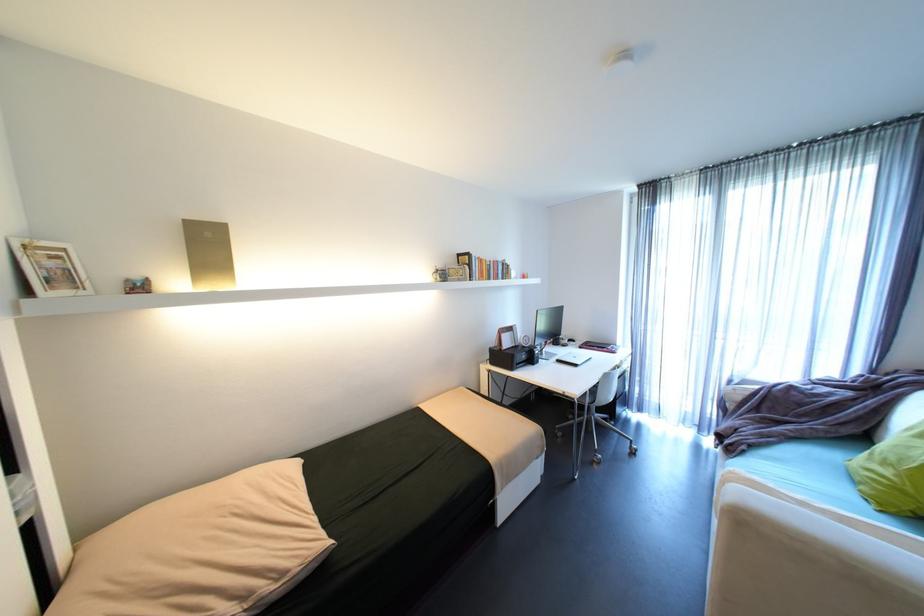
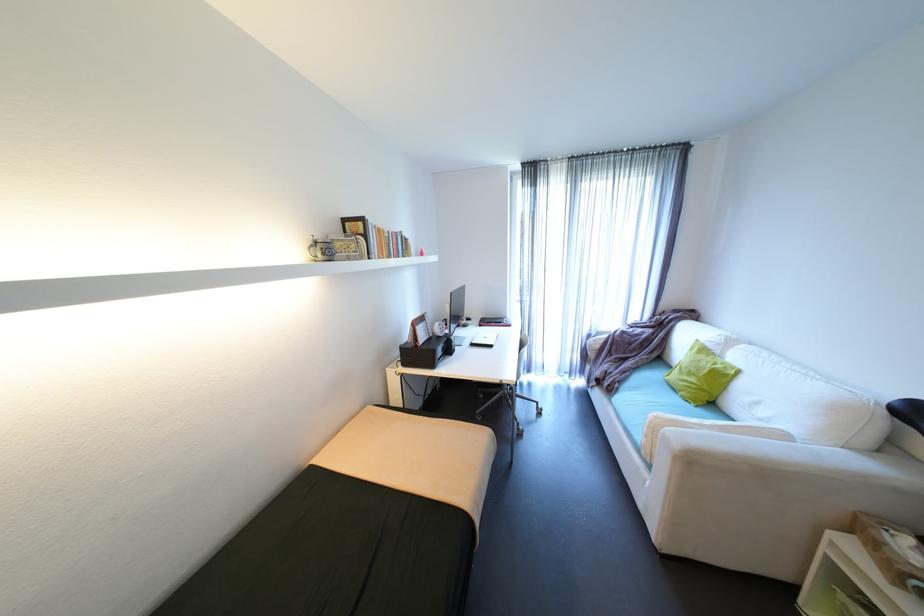
Find the pixel in the second image that matches (769,440) in the first image.

(630, 377)